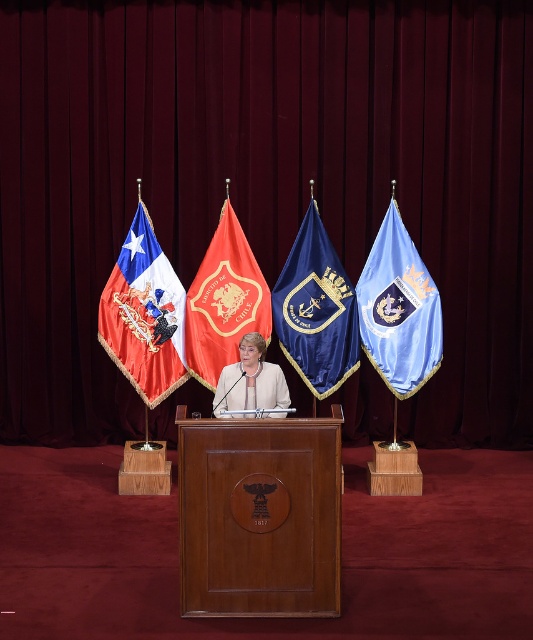
Question: Which object is the closest to the red fabric flag at center?

Choices:
 (A) navy blue fabric flag at center
 (B) light blue fabric flag at right

Answer: (A)

Question: Which object is the closest to the navy blue fabric flag at center?

Choices:
 (A) matte white blouse at center
 (B) dark red velvet curtain at center
 (C) wooden podium at center
 (D) red fabric flag at center

Answer: (D)

Question: Does light blue fabric flag at right have a larger size compared to matte white blouse at center?

Choices:
 (A) yes
 (B) no

Answer: (B)

Question: Is wooden podium at center above light blue fabric flag at right?

Choices:
 (A) no
 (B) yes

Answer: (A)

Question: Can you confirm if dark red velvet curtain at center is smaller than matte white blouse at center?

Choices:
 (A) no
 (B) yes

Answer: (A)

Question: Based on their relative distances, which object is farther from the matte white blouse at center?

Choices:
 (A) wooden podium at center
 (B) dark red velvet curtain at center
 (C) red satin flag at left

Answer: (B)